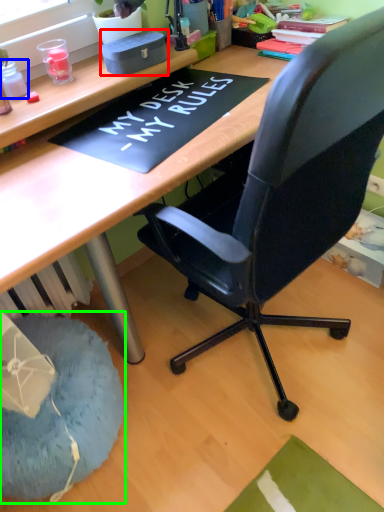
Question: Which object is positioned closest to stationery (highlighted by a red box)? Select from stationery (highlighted by a blue box) and bean bag chair (highlighted by a green box).

Choices:
 (A) stationery
 (B) bean bag chair

Answer: (A)